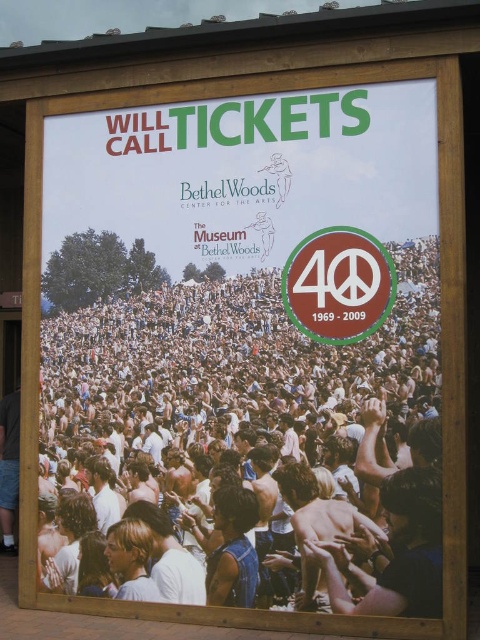
Can you confirm if matte white signboard at center is smaller than matte brown peace sign at center?

No.

From the picture: Is matte white signboard at center thinner than matte brown peace sign at center?

Incorrect, matte white signboard at center's width is not less than matte brown peace sign at center's.

Who is more forward, (x=166, y=188) or (x=350, y=269)?

Positioned in front is point (x=350, y=269).

Where is `matte white signboard at center`? The image size is (480, 640). matte white signboard at center is located at coordinates (230, 184).

Does white cotton crowd at center have a greater height compared to matte brown peace sign at center?

Correct, white cotton crowd at center is much taller as matte brown peace sign at center.

How distant is white cotton crowd at center from matte brown peace sign at center?

They are 27.46 inches apart.

Which is in front, point (305, 253) or point (327, 236)?

Positioned in front is point (327, 236).

Where is `white cotton crowd at center`? The height and width of the screenshot is (640, 480). white cotton crowd at center is located at coordinates (250, 417).

Between point (124, 557) and point (256, 212), which one is positioned in front?

Point (256, 212) is more forward.

Does white cotton crowd at center have a greater width compared to matte white signboard at center?

No.

Which is in front, point (312, 337) or point (372, 308)?

Point (372, 308) is in front.

This screenshot has height=640, width=480. What are the coordinates of `white cotton crowd at center` in the screenshot? It's located at (250, 417).